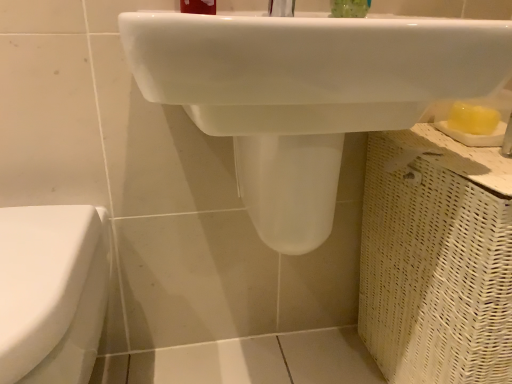
Question: Can green translucent soap at upper center be found inside matte plastic toothbrush at upper center?

Choices:
 (A) no
 (B) yes

Answer: (A)

Question: Does matte plastic toothbrush at upper center have a larger size compared to green translucent soap at upper center?

Choices:
 (A) no
 (B) yes

Answer: (B)

Question: Is matte plastic toothbrush at upper center taller than green translucent soap at upper center?

Choices:
 (A) yes
 (B) no

Answer: (A)

Question: Is matte plastic toothbrush at upper center smaller than green translucent soap at upper center?

Choices:
 (A) yes
 (B) no

Answer: (B)

Question: Can you confirm if matte plastic toothbrush at upper center is positioned to the left of green translucent soap at upper center?

Choices:
 (A) no
 (B) yes

Answer: (B)

Question: Looking at the image, does white glossy sink at upper center seem bigger or smaller compared to green translucent soap at upper center?

Choices:
 (A) big
 (B) small

Answer: (A)

Question: Looking at their shapes, would you say white glossy sink at upper center is wider or thinner than green translucent soap at upper center?

Choices:
 (A) wide
 (B) thin

Answer: (A)

Question: Would you say white glossy sink at upper center is to the left or to the right of green translucent soap at upper center in the picture?

Choices:
 (A) right
 (B) left

Answer: (B)

Question: From the image's perspective, is white glossy sink at upper center located above or below green translucent soap at upper center?

Choices:
 (A) below
 (B) above

Answer: (A)

Question: In terms of width, does matte plastic toothbrush at upper center look wider or thinner when compared to white glossy toilet at left?

Choices:
 (A) wide
 (B) thin

Answer: (B)

Question: Is point (205, 1) positioned closer to the camera than point (40, 380)?

Choices:
 (A) farther
 (B) closer

Answer: (A)

Question: Based on their positions, is matte plastic toothbrush at upper center located to the left or right of white glossy toilet at left?

Choices:
 (A) left
 (B) right

Answer: (B)

Question: Considering the positions of matte plastic toothbrush at upper center and white glossy toilet at left in the image, is matte plastic toothbrush at upper center bigger or smaller than white glossy toilet at left?

Choices:
 (A) small
 (B) big

Answer: (A)

Question: Relative to matte plastic toothbrush at upper center, is white glossy sink at upper center in front or behind?

Choices:
 (A) behind
 (B) front

Answer: (B)

Question: In the image, is white glossy sink at upper center on the left side or the right side of matte plastic toothbrush at upper center?

Choices:
 (A) left
 (B) right

Answer: (B)